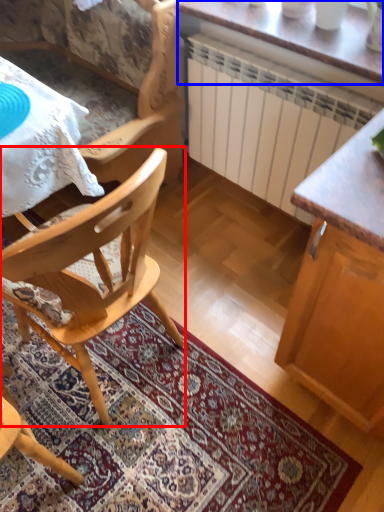
Question: Which object appears closest to the camera in this image, chair (highlighted by a red box) or table (highlighted by a blue box)?

Choices:
 (A) chair
 (B) table

Answer: (A)